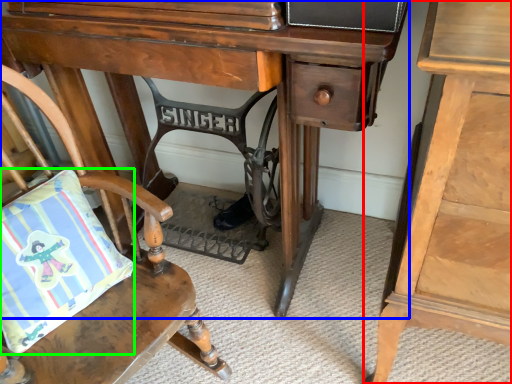
Question: Which is farther away from nightstand (highlighted by a red box)? desk (highlighted by a blue box) or pillow (highlighted by a green box)?

Choices:
 (A) desk
 (B) pillow

Answer: (B)